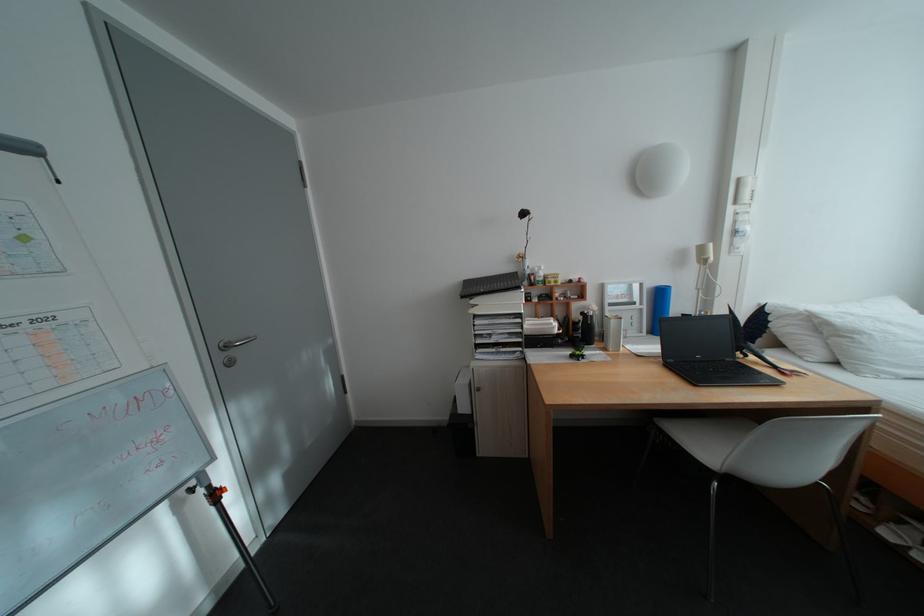
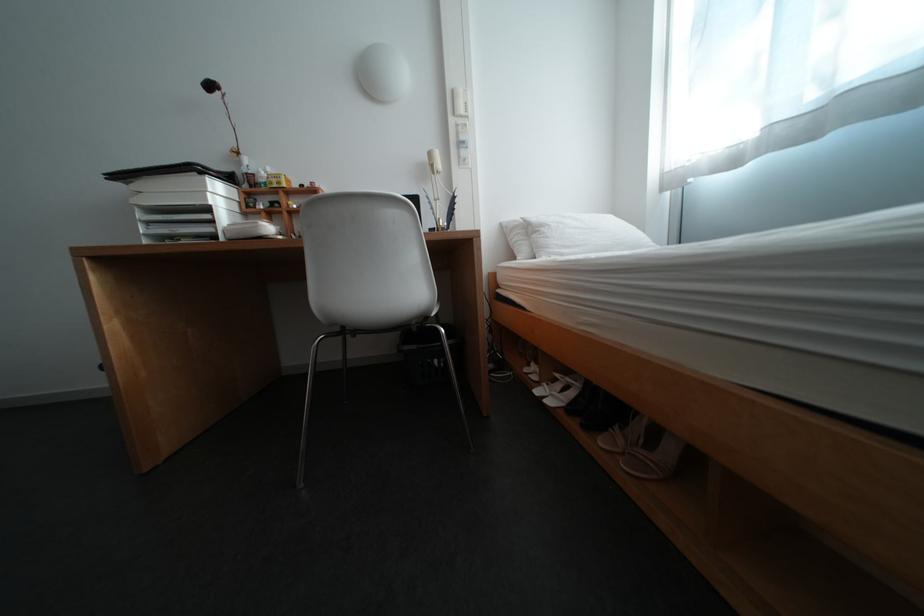
Question: Which direction would the cameraman need to move to produce the second image? Reply with the corresponding letter.

Choices:
 (A) Left
 (B) Right
 (C) Forward
 (D) Backward

Answer: (B)